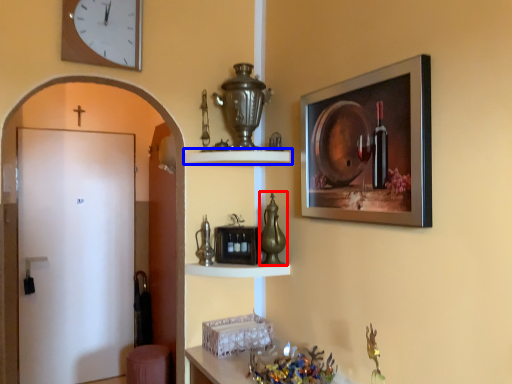
Question: Which of the following is the farthest to the observer, glass vase (highlighted by a red box) or shelf (highlighted by a blue box)?

Choices:
 (A) glass vase
 (B) shelf

Answer: (A)